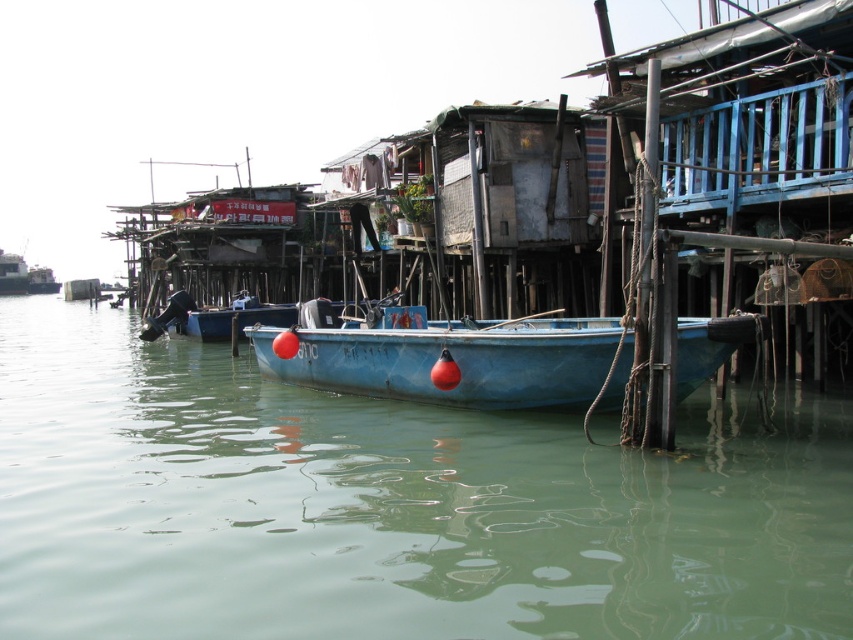
You are standing at the shore looking at the waterfront scene. There are two points marked in the image. The first point is at coordinates point (508, 474) and the second point is at point (550, 339). Which point is closer to you?

Point (508, 474) is in front of point (550, 339), so the first point is closer to you.

You are a photographer planning to capture the entire blue matte boat at center and the green matte water at center in a single frame. Based on the scene, will the boat appear wider or narrower compared to the water in the photo?

The green matte water at center might be wider than blue matte boat at center, so the boat would appear narrower in the photo compared to the water.